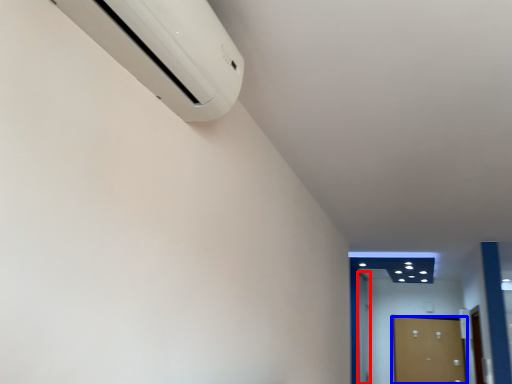
Question: Among these objects, which one is nearest to the camera, door (highlighted by a red box) or door (highlighted by a blue box)?

Choices:
 (A) door
 (B) door

Answer: (A)